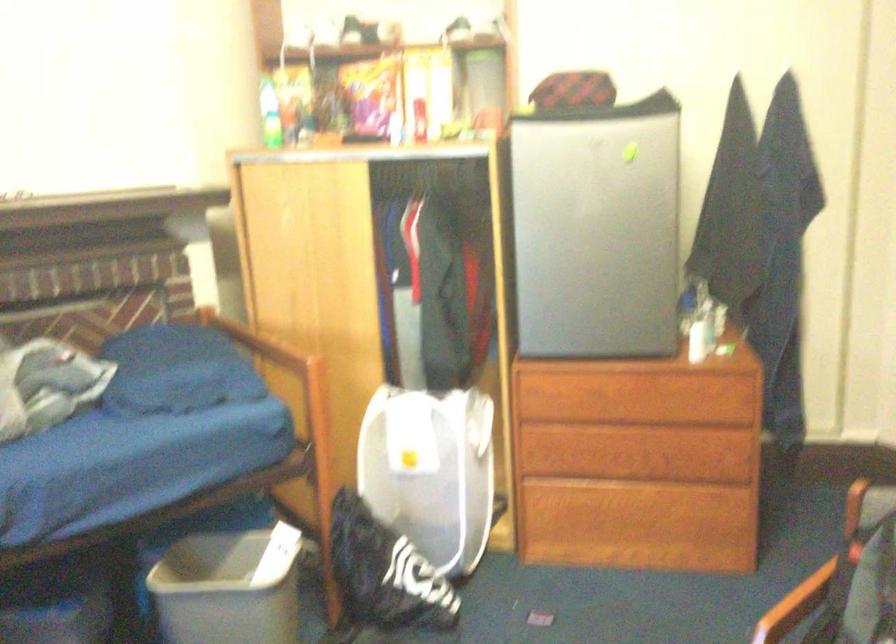
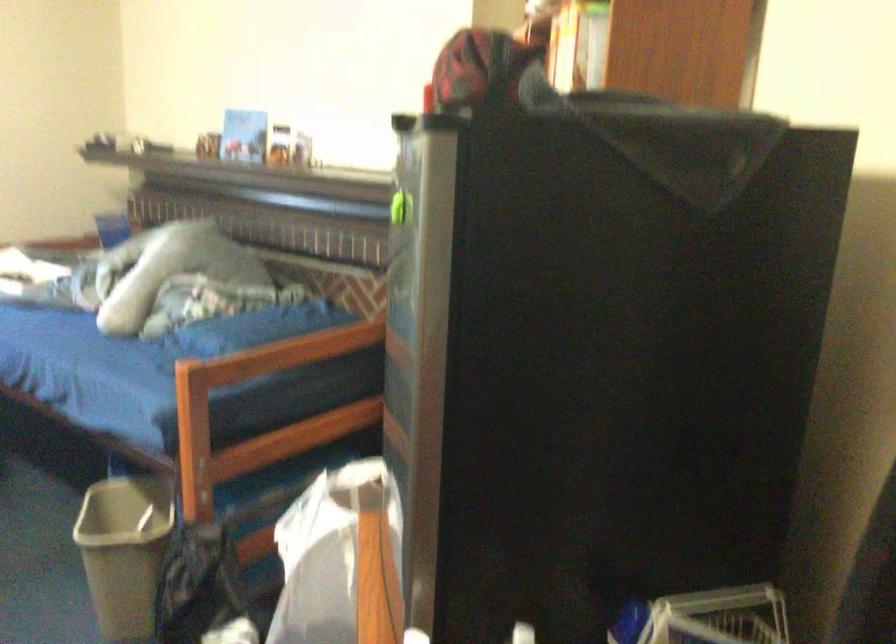
The point at (x=607, y=96) is marked in the first image. Where is the corresponding point in the second image?

(478, 68)